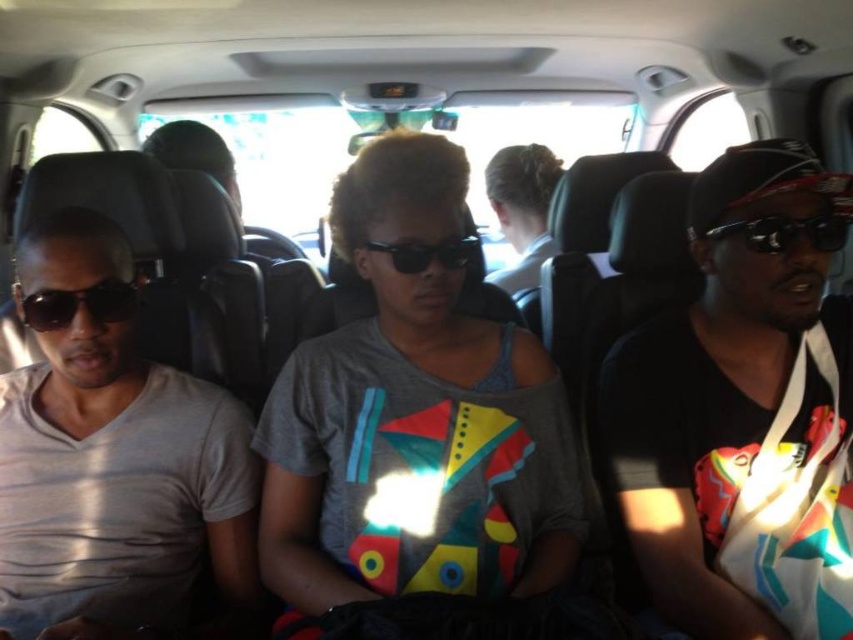
Does point (57, 296) come farther from viewer compared to point (792, 243)?

Yes, point (57, 296) is farther from viewer.

Is matte black sunglasses at left positioned before black plastic sunglasses at right?

No.

The width and height of the screenshot is (853, 640). Identify the location of matte black sunglasses at left. (78, 305).

Can you confirm if gray cotton t-shirt at center is positioned above black plastic sunglasses at right?

No.

Is point (380, 205) farther from camera compared to point (759, 252)?

No, (380, 205) is closer to viewer.

This screenshot has height=640, width=853. In order to click on gray cotton t-shirt at center in this screenshot , I will do `click(415, 420)`.

Does gray cotton t-shirt at center have a lesser height compared to black plastic sunglasses at center?

Incorrect, gray cotton t-shirt at center's height does not fall short of black plastic sunglasses at center's.

Which is more to the right, gray cotton t-shirt at center or black plastic sunglasses at center?

Positioned to the right is black plastic sunglasses at center.

Describe the element at coordinates (415, 420) in the screenshot. I see `gray cotton t-shirt at center` at that location.

Identify the location of gray cotton t-shirt at center. (415, 420).